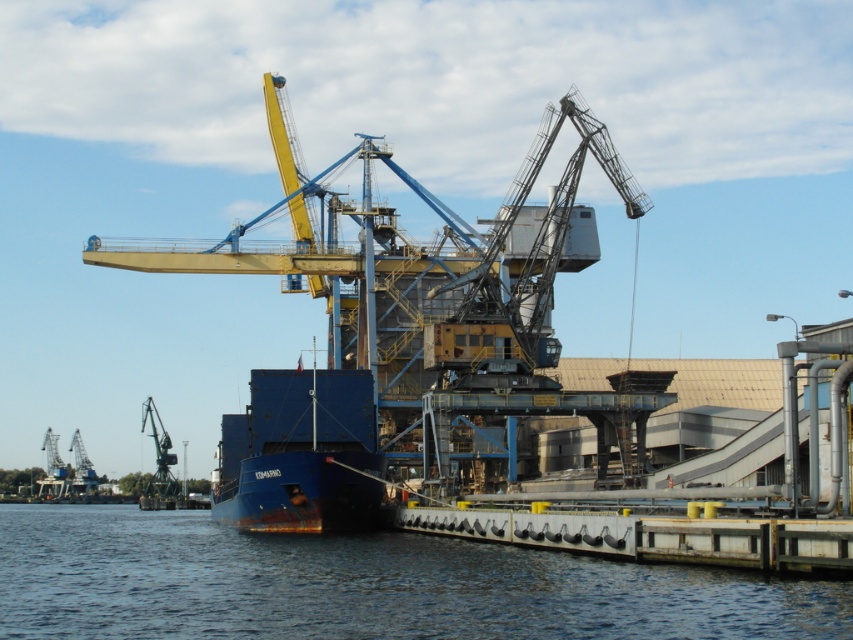
Question: Does blue water at lower left have a smaller size compared to blue matte container ship at center?

Choices:
 (A) no
 (B) yes

Answer: (A)

Question: Which object is closer to the camera taking this photo?

Choices:
 (A) blue matte container ship at center
 (B) blue water at lower left

Answer: (B)

Question: Does blue water at lower left have a larger size compared to blue matte container ship at center?

Choices:
 (A) no
 (B) yes

Answer: (B)

Question: Which object is farther from the camera taking this photo?

Choices:
 (A) yellow metallic crane at center
 (B) blue matte container ship at center

Answer: (A)

Question: Does yellow metallic crane at center lie in front of blue water at lower left?

Choices:
 (A) no
 (B) yes

Answer: (A)

Question: Estimate the real-world distances between objects in this image. Which object is closer to the blue matte container ship at center?

Choices:
 (A) blue water at lower left
 (B) yellow metallic crane at center

Answer: (A)